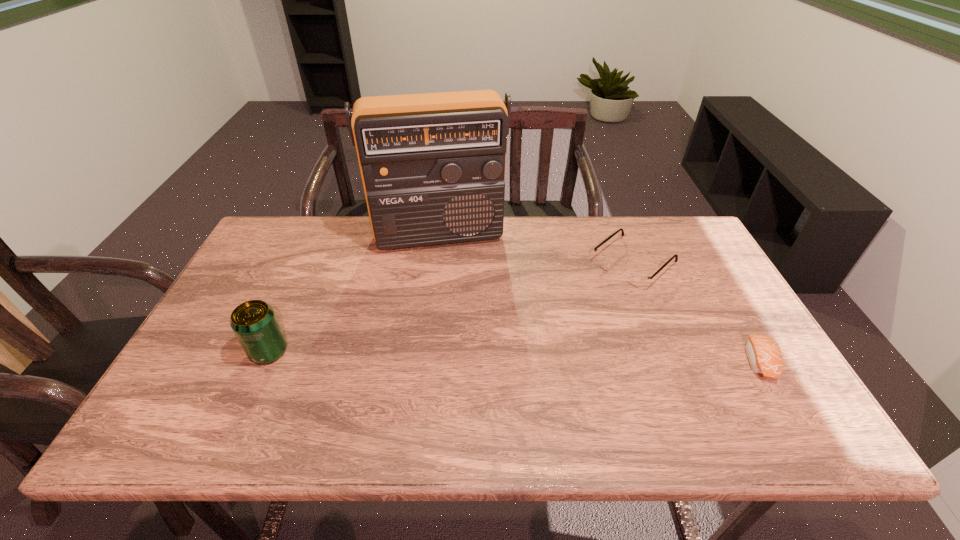
Locate an element on the screen. beer can is located at coordinates (254, 322).

Where is `the leftmost object`? This screenshot has width=960, height=540. the leftmost object is located at coordinates tap(254, 322).

Locate an element on the screen. The height and width of the screenshot is (540, 960). the rightmost object is located at coordinates [x=764, y=354].

Identify the location of the shortest object. This screenshot has width=960, height=540. (764, 354).

Identify the location of the third tallest object. This screenshot has width=960, height=540. (635, 278).

The width and height of the screenshot is (960, 540). Find the location of `the third object from left to right`. the third object from left to right is located at coordinates (x=635, y=278).

The image size is (960, 540). Identify the location of radio receiver. (432, 165).

Identify the location of the third object from right to left. The width and height of the screenshot is (960, 540). (432, 165).

Find the location of a particular element. The width and height of the screenshot is (960, 540). free space located 0.060m on the right of the second tallest object is located at coordinates (312, 352).

Where is `free spot located on the back of the rightmost object`? The width and height of the screenshot is (960, 540). free spot located on the back of the rightmost object is located at coordinates (735, 320).